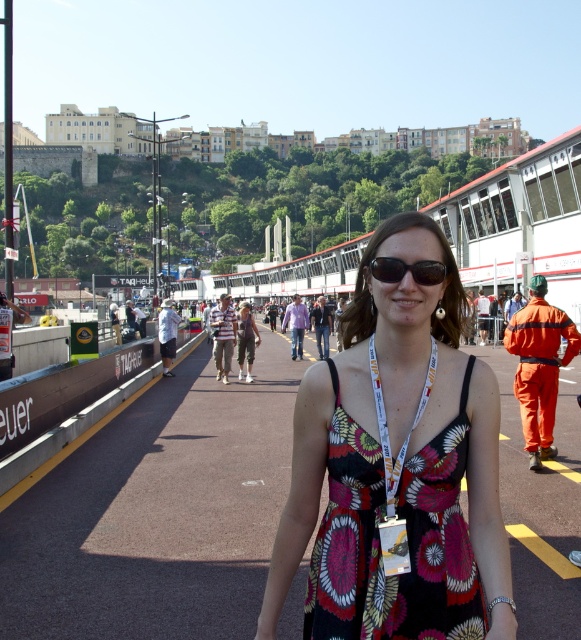
You are a photographer adjusting your camera settings. You notice two points in the frame at coordinates point (191, 376) and point (346, 420). Which point is closer to your camera lens?

Point (191, 376) is further to the camera than point (346, 420). Wait, the question asks which is closer to the camera lens. The description says point (191, 376) is further to the camera than the other point. So if point A is further than point B, then point B is closer. Therefore, the answer is point (346, 420) is closer to the camera lens.

In the scene shown: You are a photographer at the event and need to capture a clear photo of both the floral dress at center and the floral fabric dress at center. Given that your camera has a minimum focus distance of 10 meters, will you be able to focus on both subjects simultaneously?

The floral dress at center is 13.13 meters away from the floral fabric dress at center. Since the minimum focus distance of your camera is 10 meters, you can focus on both subjects as they are more than 10 meters apart.

You are a photographer trying to focus on the VIP pass lanyard worn by the person in the image. When adjusting your camera, you notice the black plastic sunglasses at center and the floral fabric dress at center. Which object should you focus on first to ensure the VIP pass lanyard is in sharp focus?

The black plastic sunglasses at center is closer to the viewer than the floral fabric dress at center. To ensure the VIP pass lanyard is in sharp focus, you should focus on the black plastic sunglasses at center first since it is closer and part of the same subject.